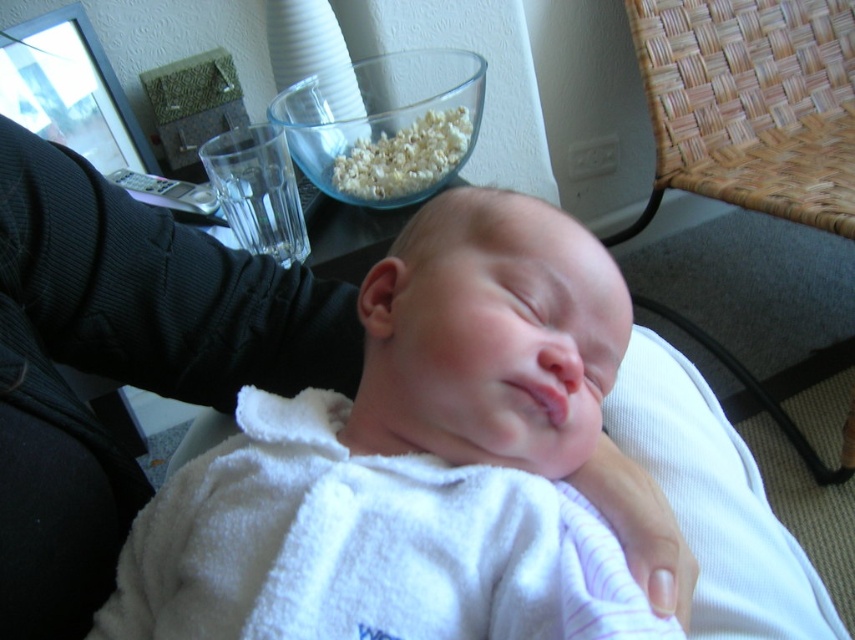
Question: Which of these objects is positioned farthest from the white fluffy robe at center?

Choices:
 (A) white soft baby at center
 (B) transparent glass bowl at upper center

Answer: (B)

Question: Does white soft baby at center have a lesser width compared to transparent glass bowl at upper center?

Choices:
 (A) yes
 (B) no

Answer: (B)

Question: Which of these objects is positioned farthest from the woven wood chair at right?

Choices:
 (A) white soft baby at center
 (B) white fluffy robe at center
 (C) transparent glass bowl at upper center

Answer: (B)

Question: Among these points, which one is farthest from the camera?

Choices:
 (A) (823, 122)
 (B) (45, 516)
 (C) (348, 202)
 (D) (449, 497)

Answer: (A)

Question: Is white soft baby at center bigger than woven wood chair at right?

Choices:
 (A) yes
 (B) no

Answer: (B)

Question: Can you confirm if white fluffy robe at center is positioned below transparent glass bowl at upper center?

Choices:
 (A) yes
 (B) no

Answer: (A)